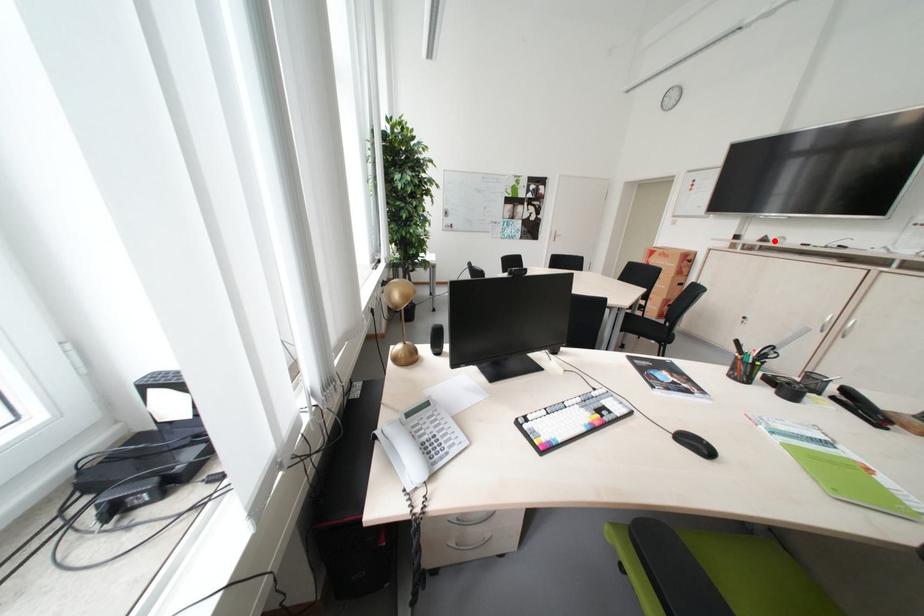
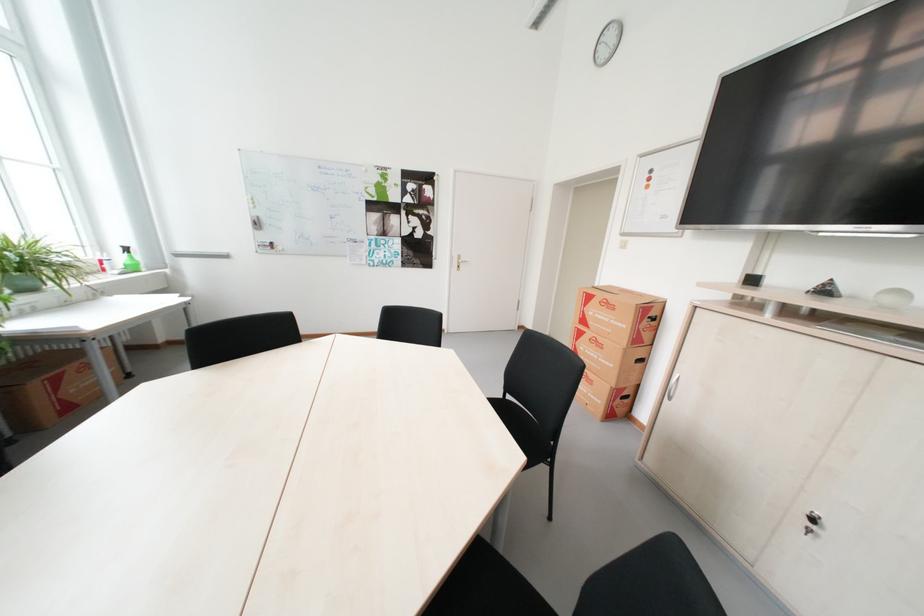
Where in the second image is the point corresponding to the highlighted location from the first image?

(835, 292)